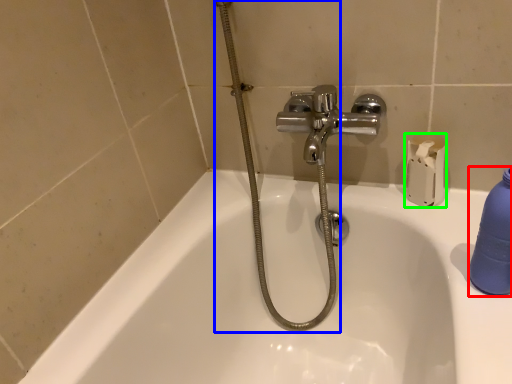
Question: Based on their relative distances, which object is farther from cleaning product (highlighted by a red box)? Choose from shower (highlighted by a blue box) and toilet paper (highlighted by a green box).

Choices:
 (A) shower
 (B) toilet paper

Answer: (A)